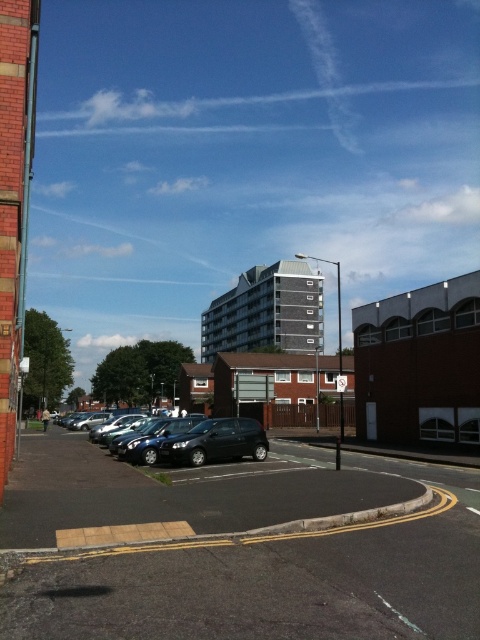
You are a delivery person trying to park your shiny black car at center in the black asphalt parking lot at center. Can your car fit into the parking lot?

The black asphalt parking lot at center has a larger size compared to shiny black car at center, so yes, the shiny black car at center can fit into the black asphalt parking lot at center.

You are a delivery driver who needs to park your truck, which is 4 meters long, in the parking area between the black asphalt parking lot at center and the shiny black car at center. Can your truck fit in that space?

The distance between the black asphalt parking lot at center and the shiny black car at center is 4.14 meters. Since your truck is 4 meters long, it can fit in that space with 0.14 meters of extra space remaining.

You are a delivery person trying to park your shiny black car at center in the black asphalt parking lot at center. According to the scene description, can you park your car there?

The black asphalt parking lot at center is located above the shiny black car at center, meaning the car is already parked there or the parking lot is elevated. Therefore, you can park your car there.